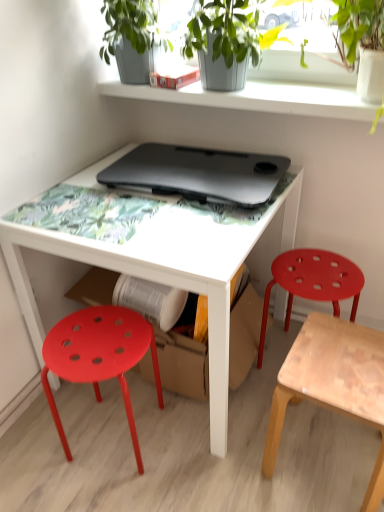
Locate an element on the screen. empty space that is ontop of matte plastic stool at lower left, which ranks as the 3th stool in right-to-left order (from a real-world perspective) is located at coordinates (96, 341).